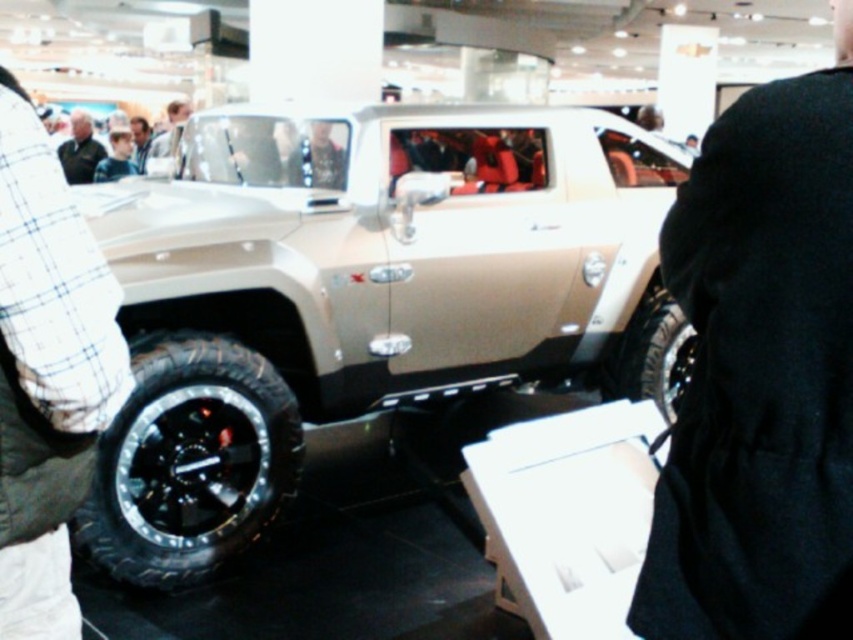
Which is in front, point (271, 476) or point (161, 132)?

Point (271, 476) is in front.

Does black rubber tire at lower left have a lesser width compared to light brown leather jacket at upper center?

Yes.

Is point (154, 541) positioned in front of point (161, 172)?

Yes.

Image resolution: width=853 pixels, height=640 pixels. Identify the location of black rubber tire at lower left. (190, 461).

Can you confirm if black fabric jacket at center is bigger than black rubber tire at lower left?

Yes.

Can you confirm if black fabric jacket at center is wider than black rubber tire at lower left?

In fact, black fabric jacket at center might be narrower than black rubber tire at lower left.

Who is more forward, (711, 554) or (165, 396)?

Point (711, 554)

Image resolution: width=853 pixels, height=640 pixels. I want to click on black fabric jacket at center, so click(761, 372).

Does plaid fabric shirt at left appear under light brown leather jacket at upper center?

Correct, plaid fabric shirt at left is located below light brown leather jacket at upper center.

What do you see at coordinates (54, 284) in the screenshot?
I see `plaid fabric shirt at left` at bounding box center [54, 284].

Describe the element at coordinates (54, 284) in the screenshot. I see `plaid fabric shirt at left` at that location.

You are a GUI agent. You are given a task and a screenshot of the screen. Output one action in this format:
    pyautogui.click(x=<x>, y=<y>)
    Task: Click on the plaid fabric shirt at left
    This screenshot has height=640, width=853.
    Given the screenshot: What is the action you would take?
    pyautogui.click(x=54, y=284)